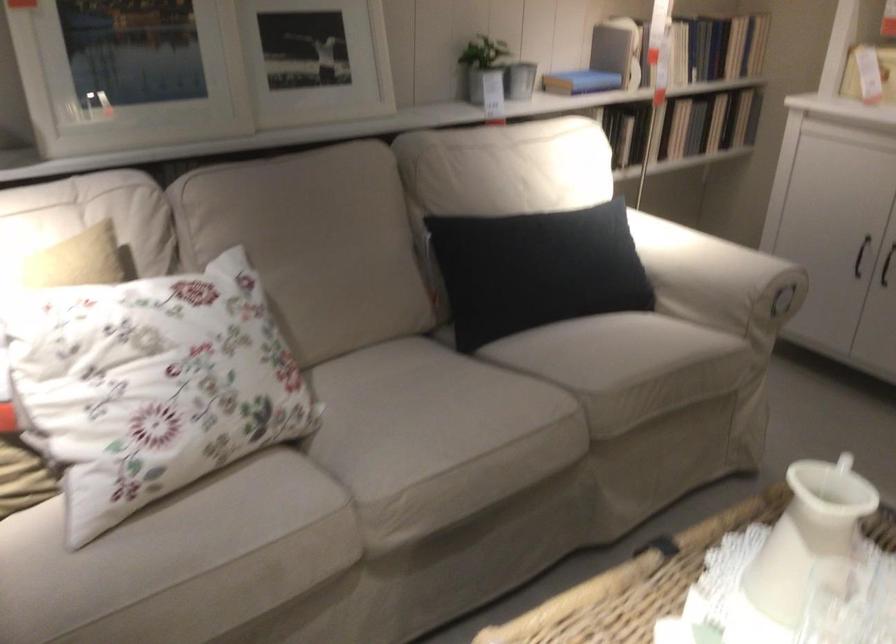
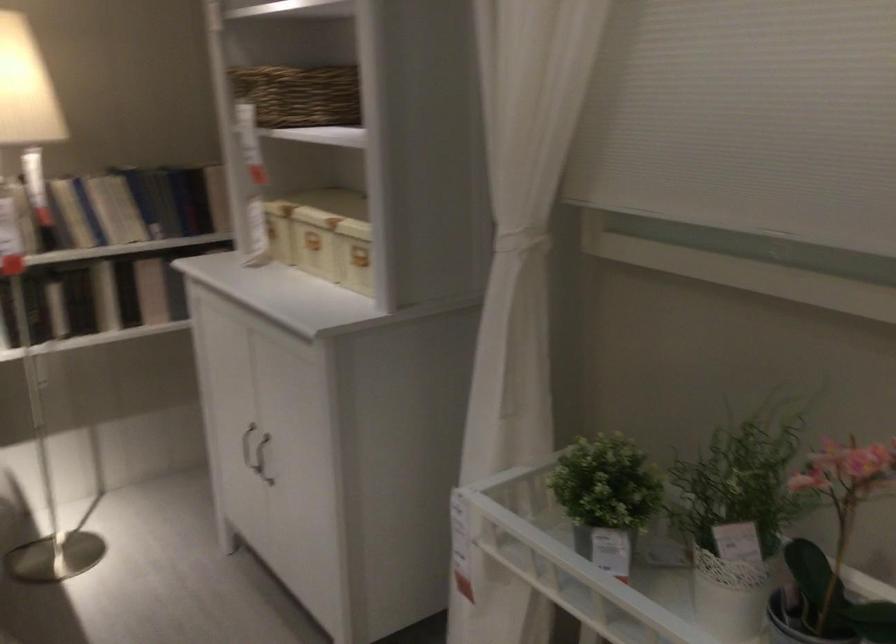
Where in the second image is the point corresponding to point (672, 120) from the first image?

(105, 296)